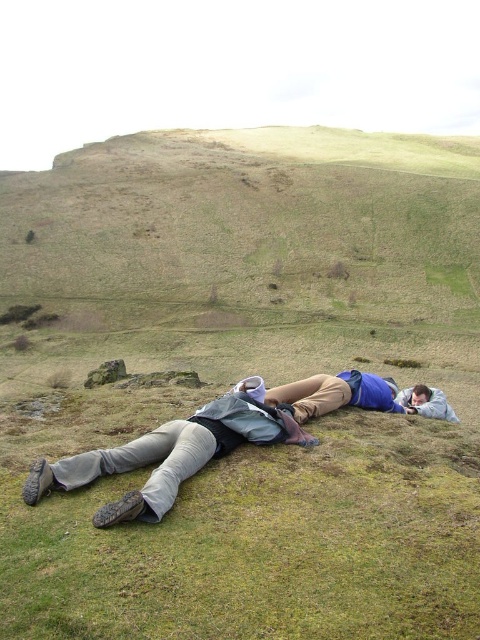
Question: Is khaki pants at center positioned at the back of light gray fabric at lower right?

Choices:
 (A) no
 (B) yes

Answer: (A)

Question: Among these points, which one is farthest from the camera?

Choices:
 (A) (439, 388)
 (B) (104, 472)

Answer: (A)

Question: Is khaki pants at center bigger than light gray fabric at lower right?

Choices:
 (A) yes
 (B) no

Answer: (B)

Question: Is khaki pants at center smaller than light gray fabric at lower right?

Choices:
 (A) no
 (B) yes

Answer: (B)

Question: Which point is farther to the camera?

Choices:
 (A) light gray fabric at lower right
 (B) khaki pants at center

Answer: (A)